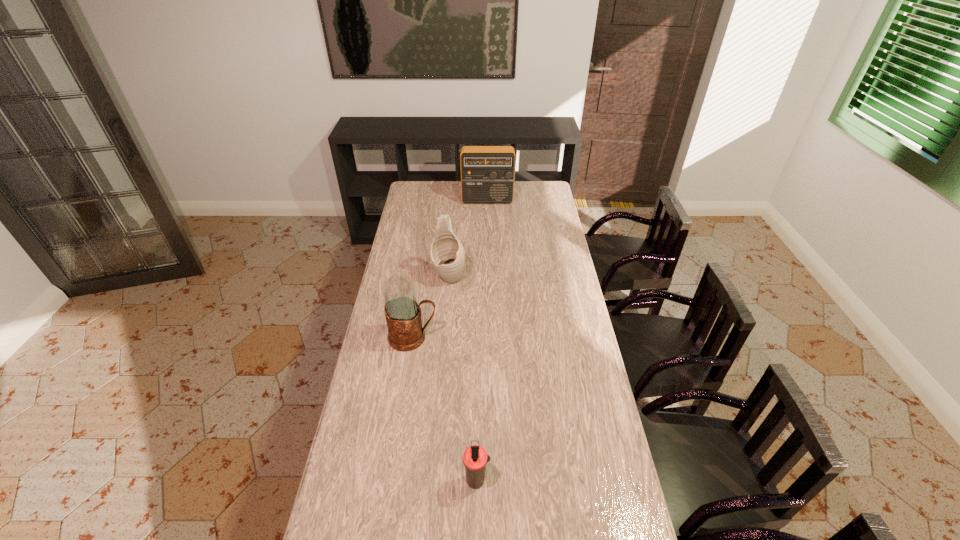
At what (x,y) coordinates should I click in order to perform the action: click on radio receiver. Please return your answer as a coordinate pair (x, y). The image size is (960, 540). Looking at the image, I should click on (487, 172).

At what (x,y) coordinates should I click in order to perform the action: click on the third nearest object. Please return your answer as a coordinate pair (x, y). The image size is (960, 540). Looking at the image, I should click on (447, 254).

The width and height of the screenshot is (960, 540). I want to click on the second nearest object, so click(403, 314).

Image resolution: width=960 pixels, height=540 pixels. In order to click on the shortest object in this screenshot , I will do `click(475, 458)`.

Image resolution: width=960 pixels, height=540 pixels. Find the location of `thermos bottle`. thermos bottle is located at coordinates coord(475,458).

Identify the location of vacant point located 0.210m on the front-facing side of the radio receiver. The image size is (960, 540). (488, 227).

Locate an element on the screen. Image resolution: width=960 pixels, height=540 pixels. vacant region located at the spout of the farther pitcher is located at coordinates pos(444,329).

Find the location of a particular element. This screenshot has width=960, height=540. vacant space located with the handle on the side of the third farthest object is located at coordinates (456, 338).

Image resolution: width=960 pixels, height=540 pixels. In order to click on free space located 0.210m on the right of the nearest object in this screenshot , I will do `click(560, 480)`.

Locate an element on the screen. object that is at the far edge is located at coordinates (487, 172).